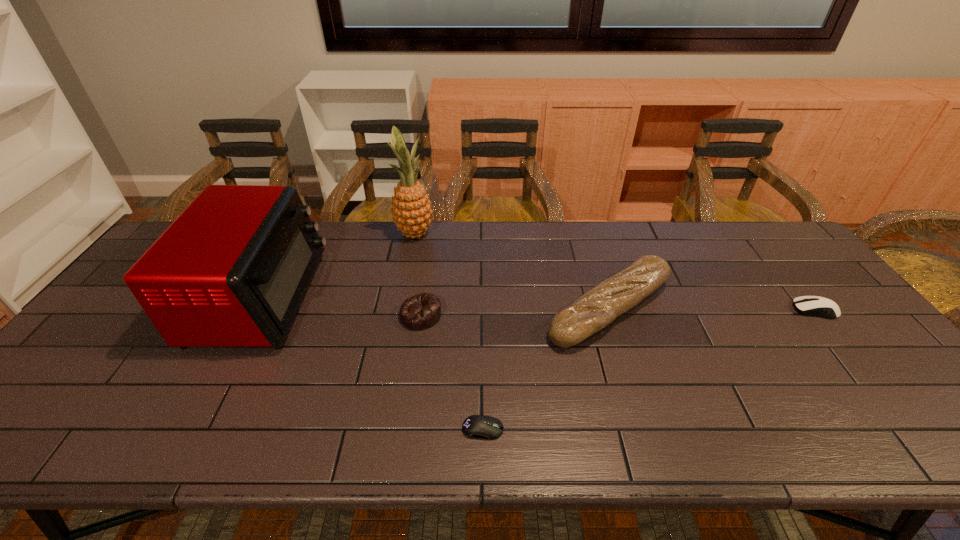
Locate an element on the screen. Image resolution: width=960 pixels, height=540 pixels. the shortest object is located at coordinates (475, 426).

You are a GUI agent. You are given a task and a screenshot of the screen. Output one action in this format:
    pyautogui.click(x=<x>, y=<y>)
    Task: Click on the vacant space positioned 0.050m on the right of the farthest object
    
    Given the screenshot: What is the action you would take?
    pyautogui.click(x=450, y=234)

Where is `free spot located on the front-facing side of the second tallest object`? This screenshot has height=540, width=960. free spot located on the front-facing side of the second tallest object is located at coordinates (334, 298).

Find the location of a particular element. This screenshot has height=540, width=960. free space located on the left of the fourth shortest object is located at coordinates (525, 309).

Locate an element on the screen. This screenshot has width=960, height=540. vacant region located 0.240m on the back of the third shortest object is located at coordinates (430, 249).

Find the location of `free location located on the back of the second shortest object`. free location located on the back of the second shortest object is located at coordinates (756, 237).

You are a GUI agent. You are given a task and a screenshot of the screen. Output one action in this format:
    pyautogui.click(x=<x>, y=<y>)
    Task: Click on the free space located 0.120m on the right of the third object from right to left
    The height and width of the screenshot is (540, 960).
    Given the screenshot: What is the action you would take?
    pyautogui.click(x=560, y=429)

This screenshot has height=540, width=960. I want to click on pineapple situated at the far edge, so click(411, 208).

Identify the location of toaster oven at the far edge. The width and height of the screenshot is (960, 540). (232, 270).

Identify the location of object that is at the near edge. (475, 426).